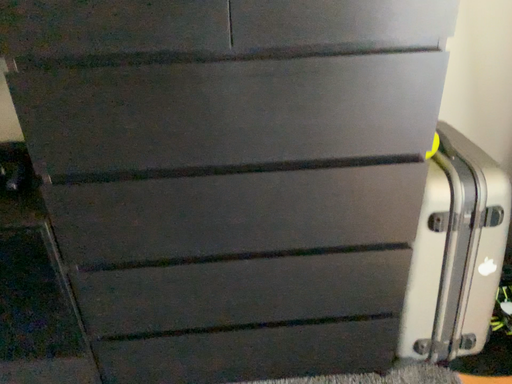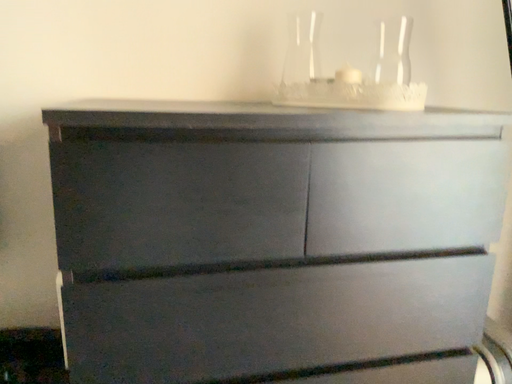
Question: How did the camera likely rotate when shooting the video?

Choices:
 (A) rotated left
 (B) rotated right

Answer: (B)